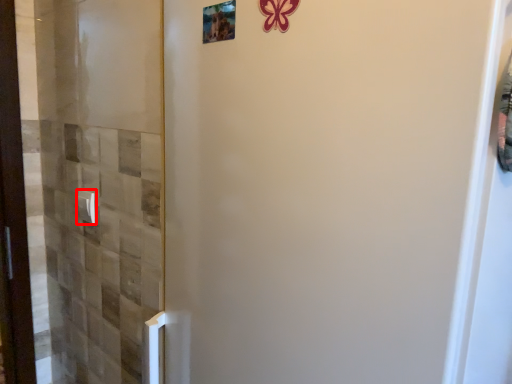
Question: Where is door handle (annotated by the red box) located in relation to picture frame in the image?

Choices:
 (A) left
 (B) right

Answer: (A)